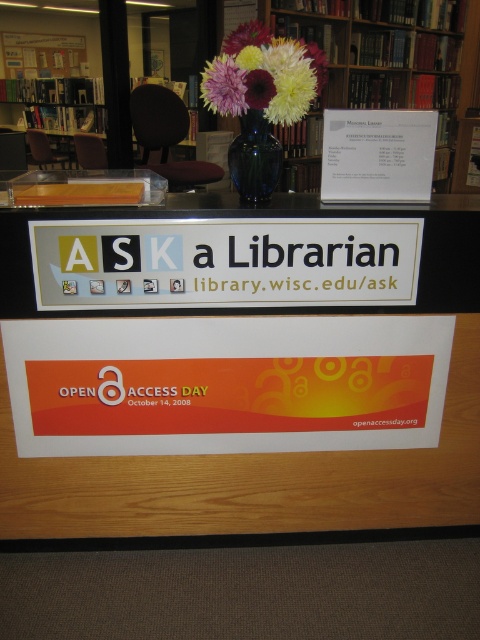
You are a visitor at the library and want to find the Open Access Day sign. You see the fluffy silk flowers at center and the vibrant purple flower at center. Which flower is positioned lower?

The fluffy silk flowers at center is located below vibrant purple flower at center, so the fluffy silk flowers at center is positioned lower.

You are a visitor at the library and want to place a small note on the desk. The note is 10 cm wide. If you want to place it between the blue glass vase at center and the pastel floral bouquet at center, will there be enough space?

The blue glass vase at center is wider than the pastel floral bouquet at center. Since the vase is wider, the space between them might be limited. However, without exact measurements of the distance between them, it is uncertain if the 10 cm note will fit. The question cannot be definitively answered with the given information.

You are standing in front of the library desk and notice two points marked on the desk. The first point is at coordinate point (x=271, y=465) and the second is at point (x=283, y=17). Which point appears closer to you?

Point (x=271, y=465) is closer to the camera than point (x=283, y=17), so the first point is closer to you.